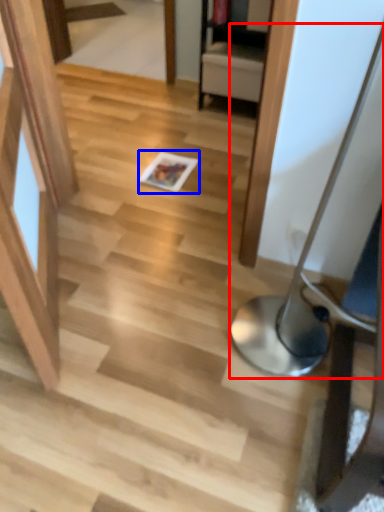
Question: Which of the following is the closest to the observer, table lamp (highlighted by a red box) or magazine (highlighted by a blue box)?

Choices:
 (A) table lamp
 (B) magazine

Answer: (A)